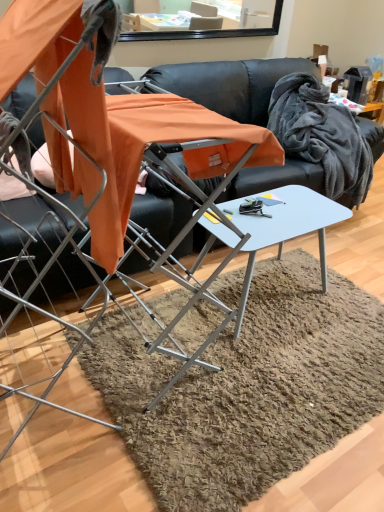
Question: Is black leather couch at center taller than metallic silver folding chair at center?

Choices:
 (A) no
 (B) yes

Answer: (A)

Question: From the image's perspective, is black leather couch at center on top of metallic silver folding chair at center?

Choices:
 (A) no
 (B) yes

Answer: (B)

Question: Is black leather couch at center closer to the viewer compared to metallic silver folding chair at center?

Choices:
 (A) yes
 (B) no

Answer: (B)

Question: From a real-world perspective, is black leather couch at center physically below metallic silver folding chair at center?

Choices:
 (A) yes
 (B) no

Answer: (A)

Question: Would you say black leather couch at center is a long distance from metallic silver folding chair at center?

Choices:
 (A) yes
 (B) no

Answer: (A)

Question: From their relative heights in the image, would you say black leather couch at center is taller or shorter than metallic silver folding chair at center?

Choices:
 (A) tall
 (B) short

Answer: (B)

Question: Is black leather couch at center in front of or behind metallic silver folding chair at center in the image?

Choices:
 (A) front
 (B) behind

Answer: (B)

Question: Which is correct: black leather couch at center is inside metallic silver folding chair at center, or outside of it?

Choices:
 (A) outside
 (B) inside

Answer: (A)

Question: Considering the relative positions of black leather couch at center and metallic silver folding chair at center in the image provided, is black leather couch at center to the left or to the right of metallic silver folding chair at center?

Choices:
 (A) right
 (B) left

Answer: (A)

Question: Based on their positions, is gray fluffy blanket at upper right located to the left or right of black leather couch at center?

Choices:
 (A) left
 (B) right

Answer: (B)

Question: Is gray fluffy blanket at upper right bigger or smaller than black leather couch at center?

Choices:
 (A) small
 (B) big

Answer: (A)

Question: From a real-world perspective, is gray fluffy blanket at upper right positioned above or below black leather couch at center?

Choices:
 (A) above
 (B) below

Answer: (A)

Question: From the image's perspective, is gray fluffy blanket at upper right located above or below black leather couch at center?

Choices:
 (A) below
 (B) above

Answer: (B)

Question: Would you say white glossy table at center is to the left or to the right of metallic silver folding chair at center in the picture?

Choices:
 (A) left
 (B) right

Answer: (B)

Question: Is white glossy table at center wider or thinner than metallic silver folding chair at center?

Choices:
 (A) wide
 (B) thin

Answer: (B)